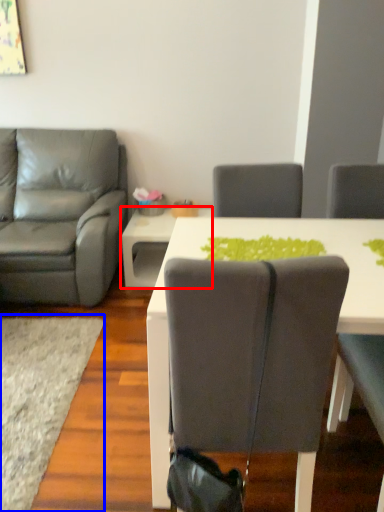
Question: Which of the following is the farthest to the observer, table (highlighted by a red box) or mat (highlighted by a blue box)?

Choices:
 (A) table
 (B) mat

Answer: (A)